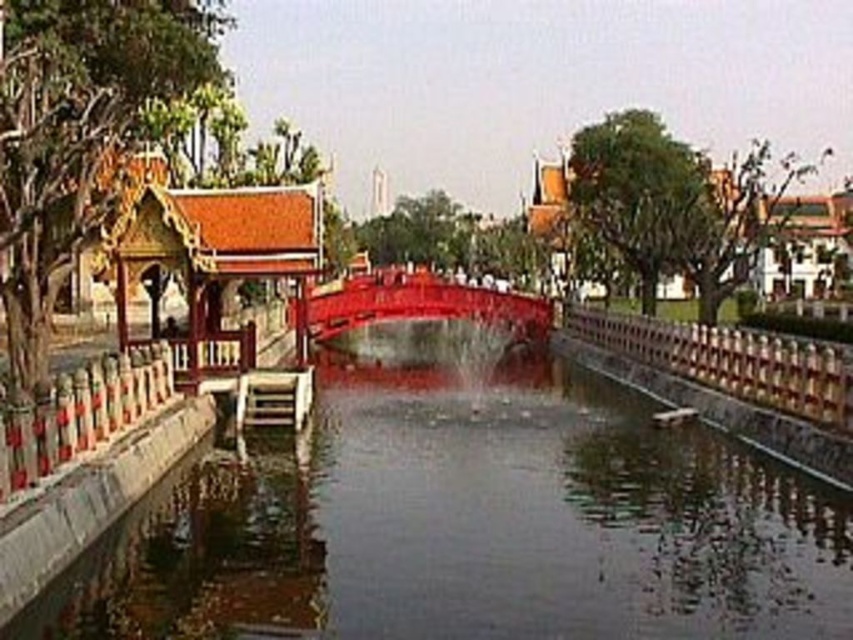
Question: Does smooth concrete river at center come behind glossy wood bridge at center?

Choices:
 (A) yes
 (B) no

Answer: (B)

Question: Is the position of smooth concrete river at center more distant than that of glossy wood bridge at center?

Choices:
 (A) no
 (B) yes

Answer: (A)

Question: Is smooth concrete river at center below glossy wood bridge at center?

Choices:
 (A) no
 (B) yes

Answer: (B)

Question: Which of the following is the closest to the observer?

Choices:
 (A) smooth concrete river at center
 (B) glossy wood bridge at center

Answer: (A)